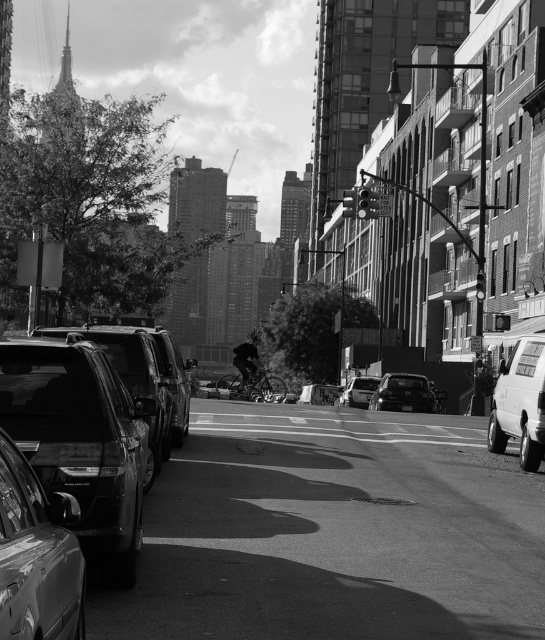
You are a delivery driver who needs to park your vehicle between the white matte van at right and the shiny black sedan at center. Based on the scene, can you fit your vehicle there?

The white matte van at right is positioned on the left side of the shiny black sedan at center, so there is space between them for your vehicle.

You are standing on the sidewalk in the urban street scene. There is a point marked at coordinates (83,440). Which object does this point correspond to?

The point at coordinates (83,440) corresponds to the shiny black SUV at left.

Based on the photo, you are a delivery person trying to park your van between the shiny black suv at left and the shiny metallic car at lower left. Can you fit your van there if it requires 3 meters of space?

The shiny black suv at left is to the left of the shiny metallic car at lower left, but the exact distance between them isn not provided in the description. Without knowing the actual spacing, it is impossible to determine if your van can fit there.